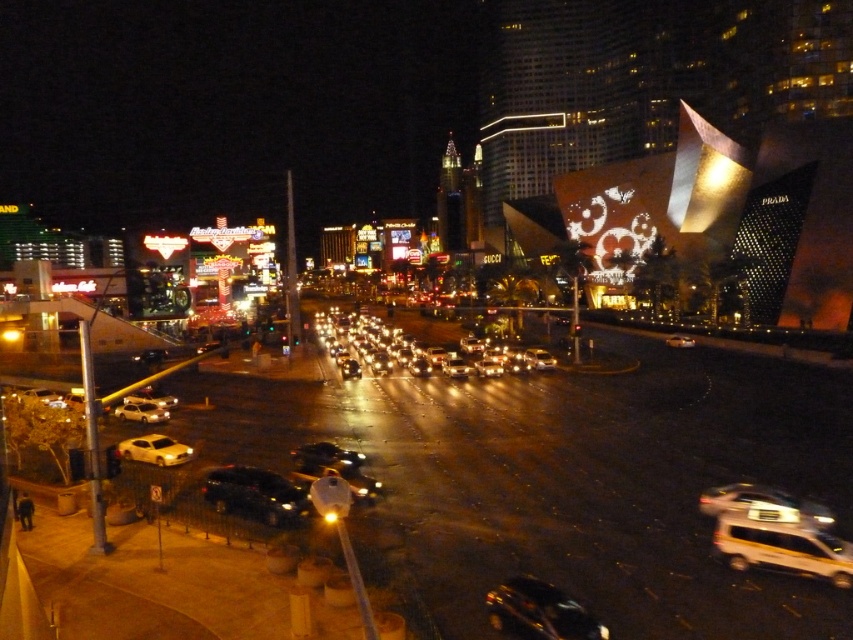
You are a pedestrian standing at the center of the street. You need to cross the street to reach the Prada building on the right. Which vehicle, the yellow metallic van at lower right or the shiny black car at lower left, is closer to the curb where you are standing?

The yellow metallic van at lower right is closer to the curb where you are standing because it is positioned below the shiny black car at lower left, indicating it is nearer to the pedestrian.

From the picture: You are a pedestrian standing at the center of the street in the image. You see the white glossy sedan at lower left and the white glossy car at lower left. Which one is positioned more to the left side of the street?

The white glossy sedan at lower left is positioned more to the left side of the street compared to the white glossy car at lower left.

You are a pedestrian standing at the edge of the street in this nighttime scene. You see a white glossy sedan at lower left and a white glossy car at lower left. Which one is closer to you?

The white glossy sedan at lower left is closer to you because the white glossy car at lower left is behind it.